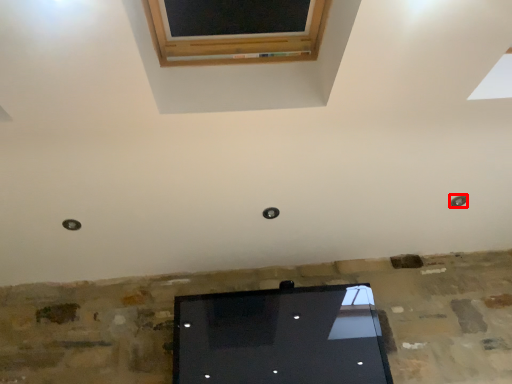
Question: From the image's perspective, where is hole (annotated by the red box) located in relation to hole in the image?

Choices:
 (A) above
 (B) below

Answer: (A)